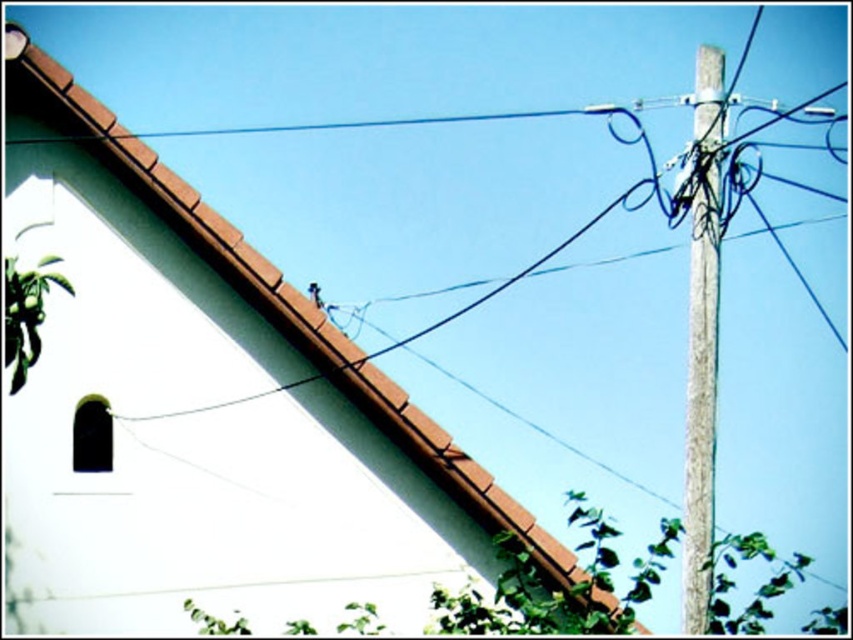
Who is positioned more to the right, brown tile roof at upper left or gray concrete pole at right?

gray concrete pole at right is more to the right.

Can you confirm if brown tile roof at upper left is bigger than gray concrete pole at right?

No.

Is point (70, 288) less distant than point (721, 108)?

That is True.

Locate an element on the screen. brown tile roof at upper left is located at coordinates (204, 410).